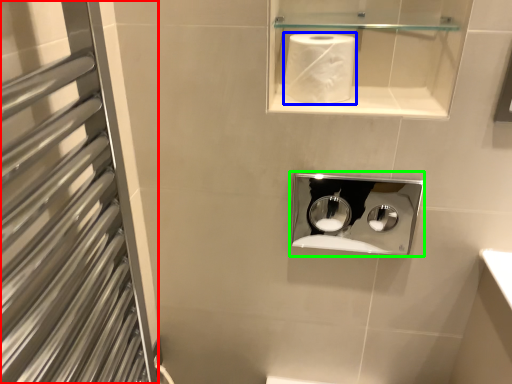
Question: Which object is positioned farthest from screen door (highlighted by a red box)? Select from paper towel (highlighted by a blue box) and medicine cabinet (highlighted by a green box).

Choices:
 (A) paper towel
 (B) medicine cabinet

Answer: (B)